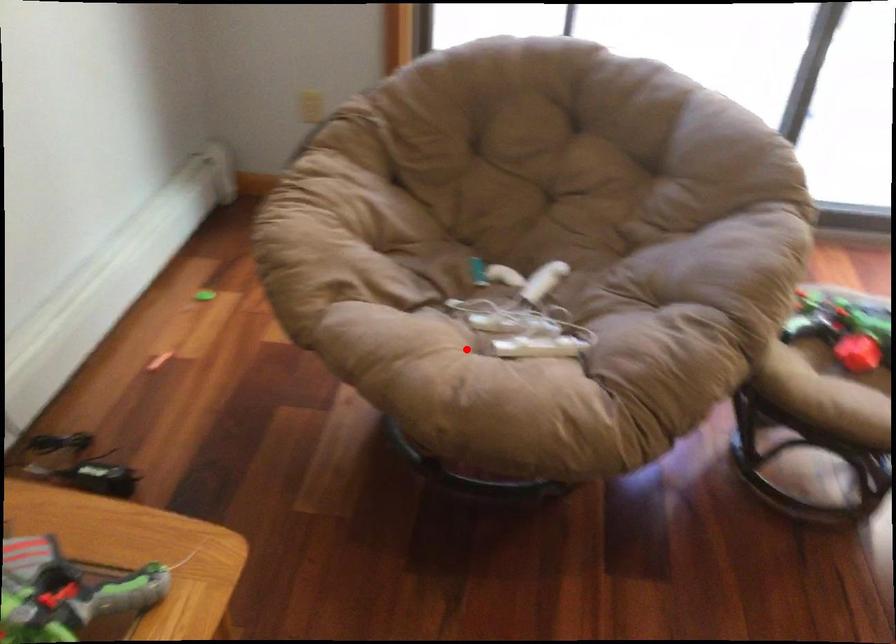
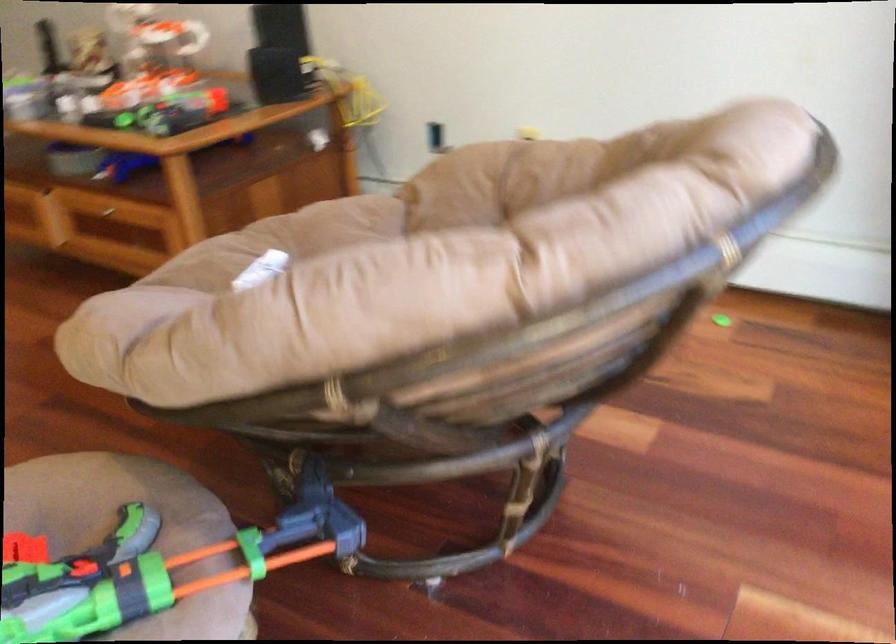
The point at the highlighted location is marked in the first image. Where is the corresponding point in the second image?

(281, 241)